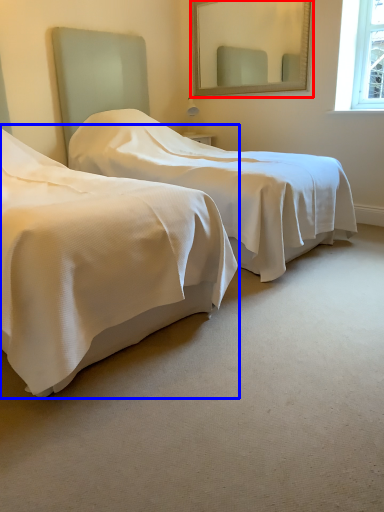
Question: Which of the following is the farthest to the observer, mirror (highlighted by a red box) or bed (highlighted by a blue box)?

Choices:
 (A) mirror
 (B) bed

Answer: (A)